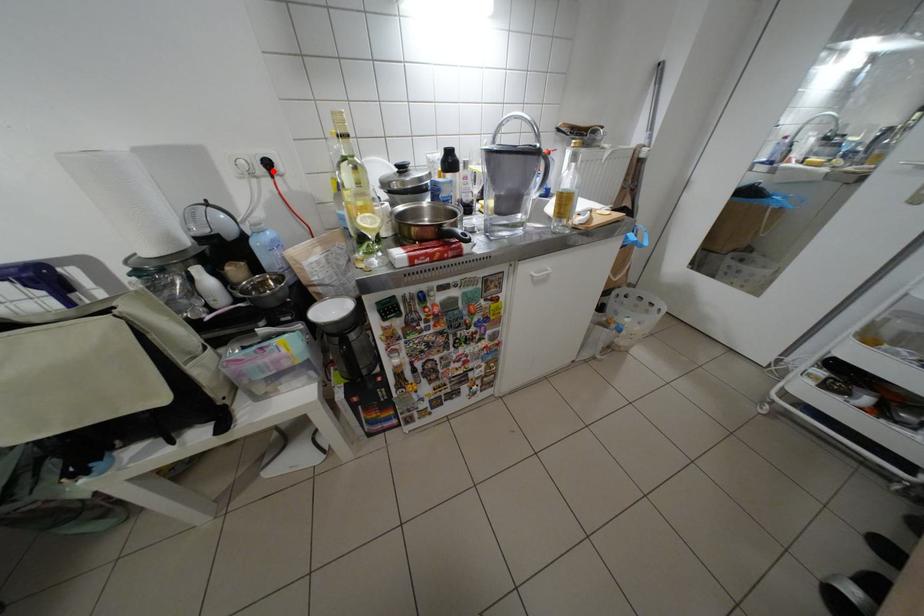
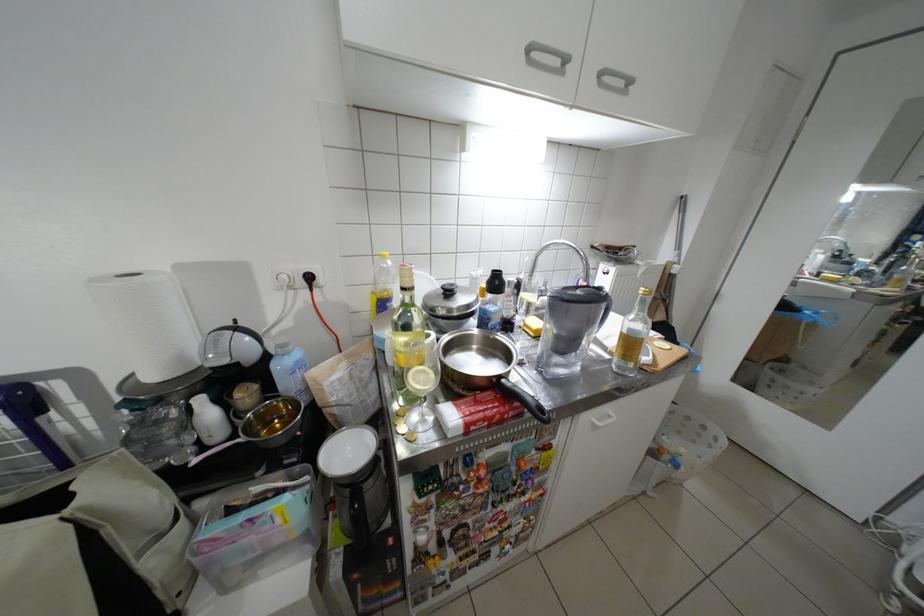
The point at the highlighted location is marked in the first image. Where is the corresponding point in the second image?

(312, 285)